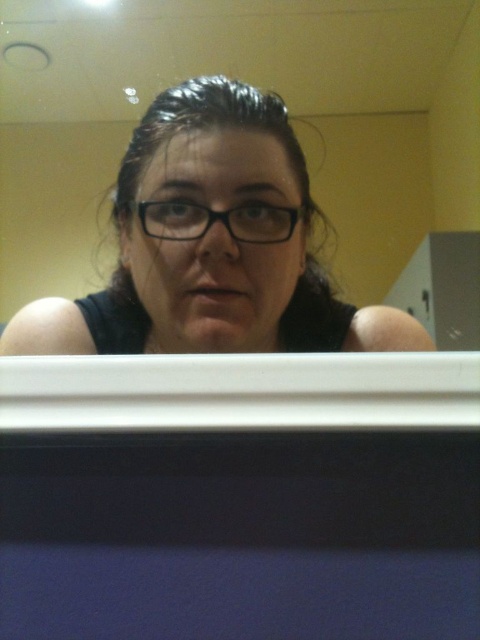
Who is more forward, (223, 289) or (274, 225)?

Point (223, 289)

Can you confirm if matte black glasses at center is positioned below black plastic glasses at center?

Yes.

Is point (326, 330) less distant than point (228, 224)?

That is False.

Where is `matte black glasses at center`? matte black glasses at center is located at coordinates (213, 244).